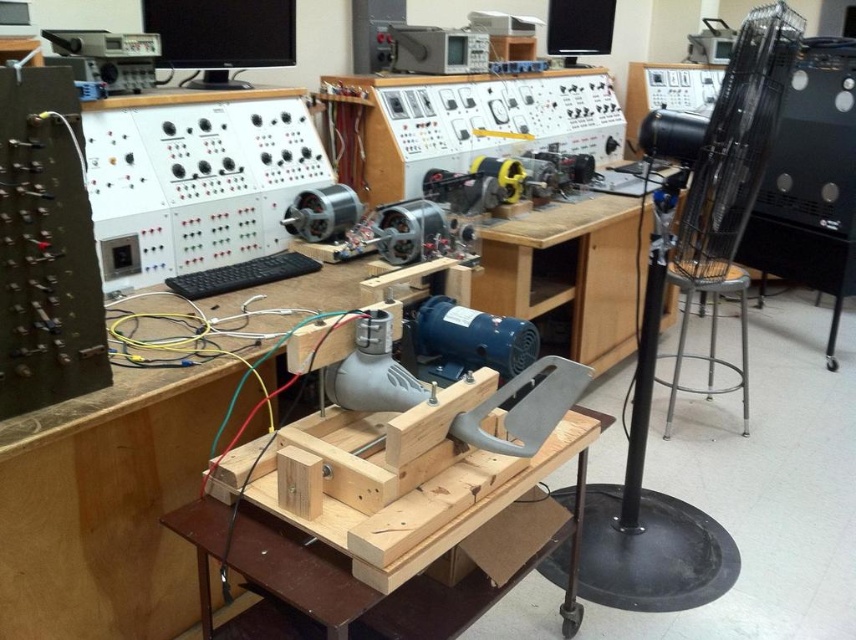
Question: Among these objects, which one is nearest to the camera?

Choices:
 (A) wooden at center
 (B) metallic silver stool at right

Answer: (A)

Question: Which point appears farthest from the camera in this image?

Choices:
 (A) (204, 620)
 (B) (742, 349)

Answer: (B)

Question: Observing the image, what is the correct spatial positioning of wooden at center in reference to metallic silver stool at right?

Choices:
 (A) right
 (B) left

Answer: (B)

Question: Does wooden at center appear under metallic silver stool at right?

Choices:
 (A) no
 (B) yes

Answer: (B)

Question: Does wooden at center appear over metallic silver stool at right?

Choices:
 (A) yes
 (B) no

Answer: (B)